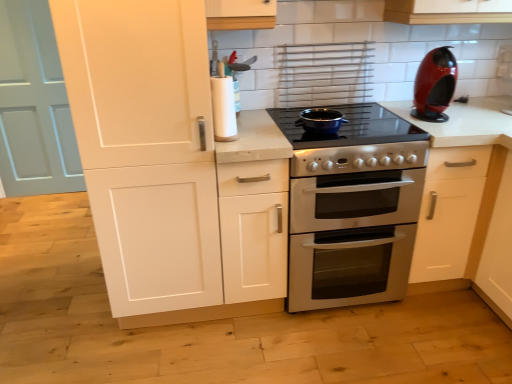
At what (x,y) coordinates should I click in order to perform the action: click on vacant space to the right of matte black pot at center. Please return your answer as a coordinate pair (x, y). This screenshot has width=512, height=384. Looking at the image, I should click on (370, 120).